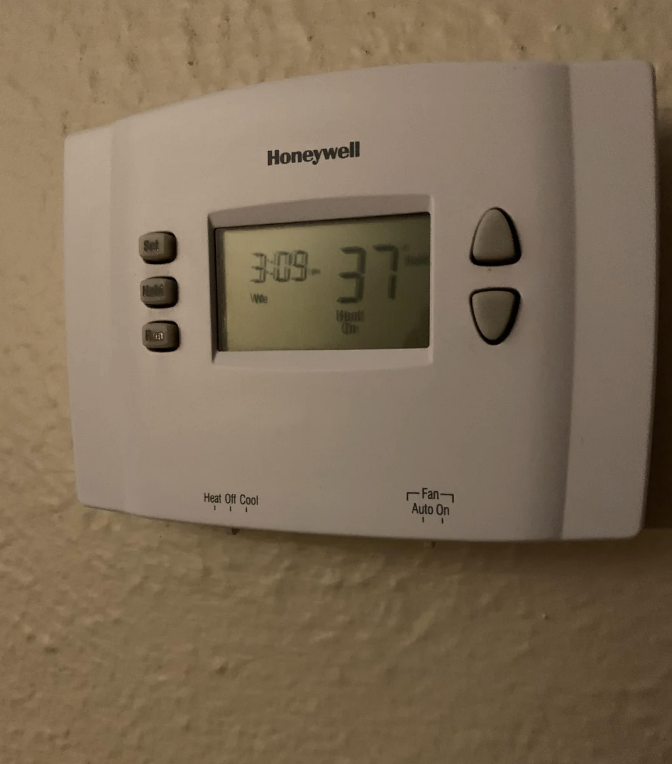
You are a GUI agent. You are given a task and a screenshot of the screen. Output one action in this format:
    pyautogui.click(x=<x>, y=<y>)
    Task: Click on the down push button
    
    Given the screenshot: What is the action you would take?
    pyautogui.click(x=487, y=315)